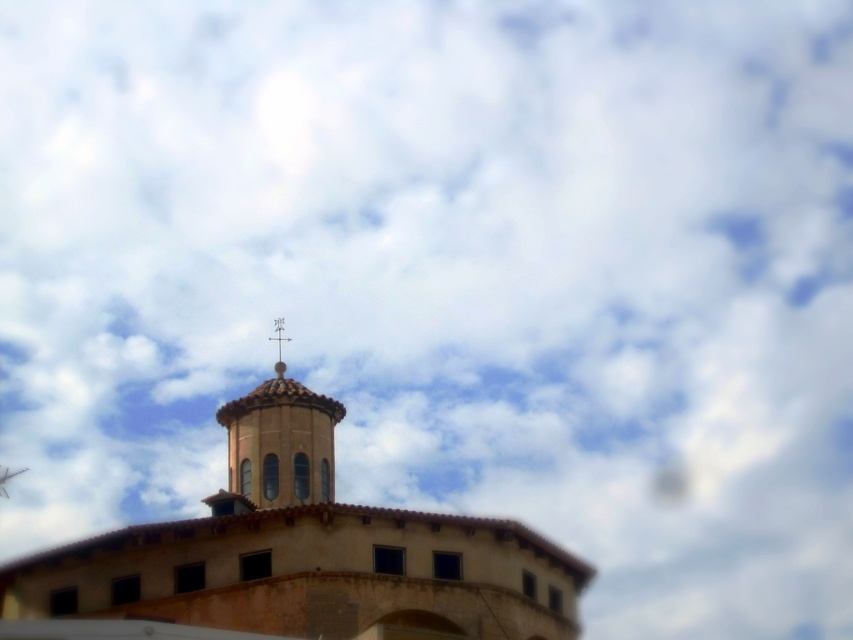
Question: Can you confirm if brown textured dome at center is thinner than metallic cross at upper center?

Choices:
 (A) yes
 (B) no

Answer: (B)

Question: Can you confirm if brown textured dome at center is thinner than matte orange bell tower at center?

Choices:
 (A) yes
 (B) no

Answer: (B)

Question: Among these points, which one is farthest from the camera?

Choices:
 (A) (300, 499)
 (B) (334, 624)

Answer: (A)

Question: Which object is the closest to the metallic cross at upper center?

Choices:
 (A) matte orange bell tower at center
 (B) brown textured dome at center

Answer: (A)

Question: Can you confirm if matte orange bell tower at center is wider than metallic cross at upper center?

Choices:
 (A) yes
 (B) no

Answer: (A)

Question: Which object appears farthest from the camera in this image?

Choices:
 (A) brown textured dome at center
 (B) metallic cross at upper center

Answer: (B)